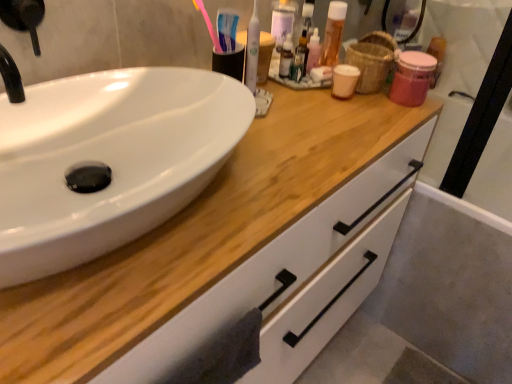
In order to click on empty space that is ontop of wooden cabinet at center (from a real-world perspective) in this screenshot , I will do `click(278, 141)`.